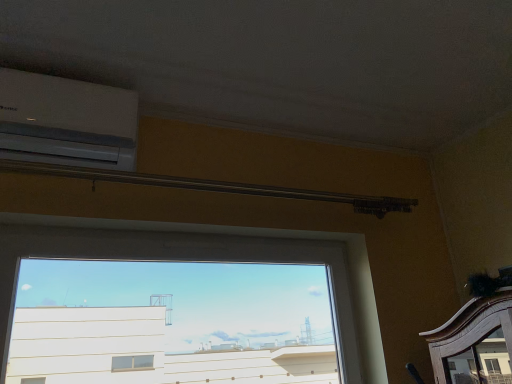
Question: Would you say transparent glass window at center is part of white plastic air conditioner at upper left's contents?

Choices:
 (A) yes
 (B) no

Answer: (B)

Question: Can you confirm if white plastic air conditioner at upper left is taller than transparent glass window at center?

Choices:
 (A) no
 (B) yes

Answer: (A)

Question: Does white plastic air conditioner at upper left have a lesser height compared to transparent glass window at center?

Choices:
 (A) no
 (B) yes

Answer: (B)

Question: Does white plastic air conditioner at upper left have a larger size compared to transparent glass window at center?

Choices:
 (A) yes
 (B) no

Answer: (B)

Question: Is the position of white plastic air conditioner at upper left more distant than that of transparent glass window at center?

Choices:
 (A) yes
 (B) no

Answer: (A)

Question: From a real-world perspective, is white plastic air conditioner at upper left positioned under transparent glass window at center based on gravity?

Choices:
 (A) no
 (B) yes

Answer: (A)

Question: Is white plastic air conditioner at upper left at the back of transparent glass window at center?

Choices:
 (A) yes
 (B) no

Answer: (B)

Question: Is transparent glass window at center at the left side of white plastic air conditioner at upper left?

Choices:
 (A) no
 (B) yes

Answer: (A)

Question: Considering the relative sizes of transparent glass window at center and white plastic air conditioner at upper left in the image provided, is transparent glass window at center smaller than white plastic air conditioner at upper left?

Choices:
 (A) yes
 (B) no

Answer: (B)

Question: Is transparent glass window at center thinner than white plastic air conditioner at upper left?

Choices:
 (A) yes
 (B) no

Answer: (A)

Question: Is white plastic air conditioner at upper left completely or partially inside transparent glass window at center?

Choices:
 (A) yes
 (B) no

Answer: (B)

Question: Can you confirm if transparent glass window at center is wider than white plastic air conditioner at upper left?

Choices:
 (A) yes
 (B) no

Answer: (B)

Question: Looking at their shapes, would you say white plastic air conditioner at upper left is wider or thinner than transparent glass window at center?

Choices:
 (A) thin
 (B) wide

Answer: (B)